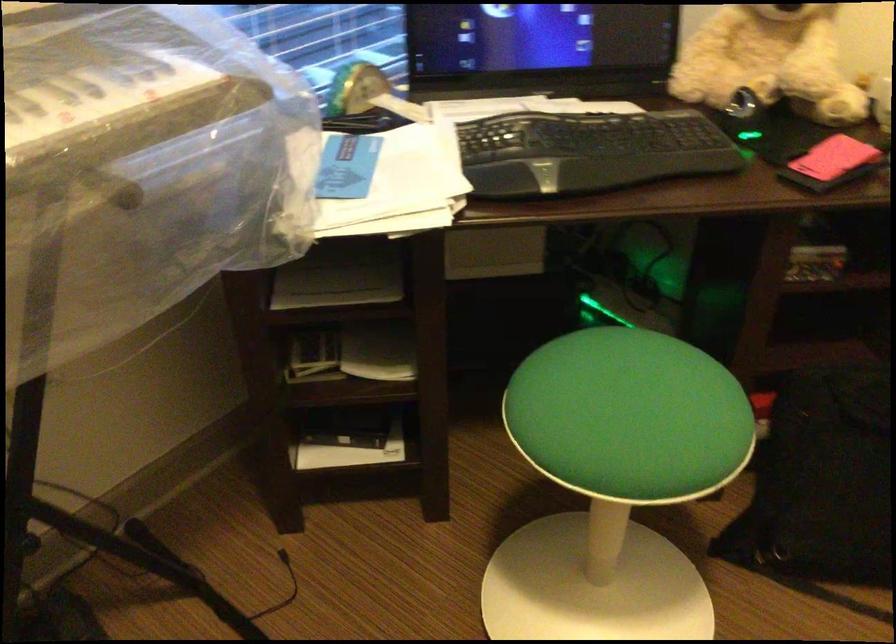
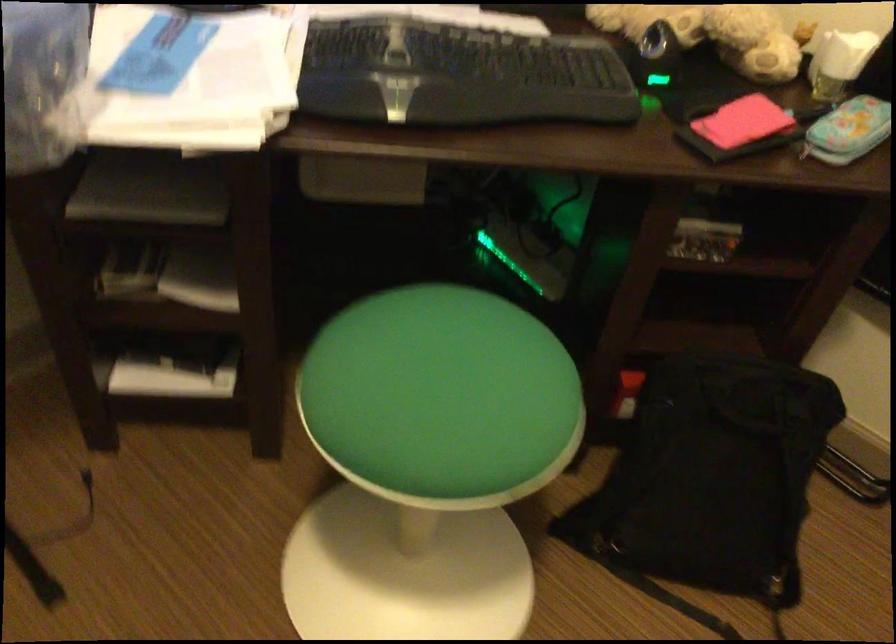
What movement of the cameraman would produce the second image?

The cameraman walked toward right, forward.